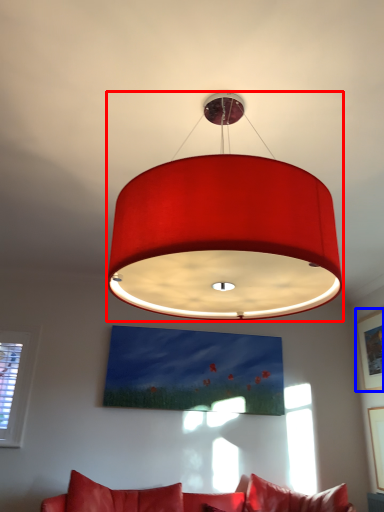
Question: Which object is further to the camera taking this photo, lamp (highlighted by a red box) or picture frame (highlighted by a blue box)?

Choices:
 (A) lamp
 (B) picture frame

Answer: (B)